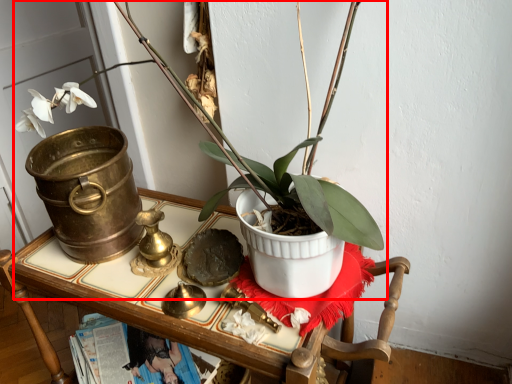
Question: From the image's perspective, considering the relative positions of houseplant (annotated by the red box) and furniture in the image provided, where is houseplant (annotated by the red box) located with respect to the staircase?

Choices:
 (A) below
 (B) above

Answer: (B)